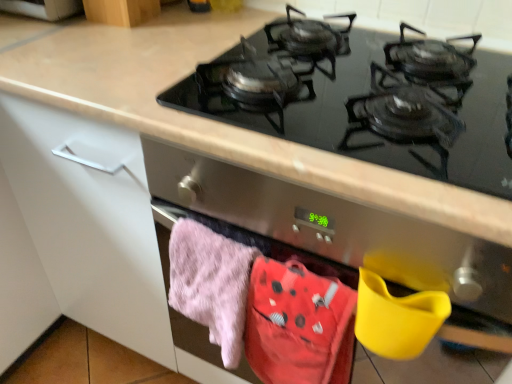
Question: Based on their sizes in the image, would you say fluffy pink towel at lower left is bigger or smaller than black glass gas stove at upper center?

Choices:
 (A) small
 (B) big

Answer: (A)

Question: From the image's perspective, relative to black glass gas stove at upper center, is fluffy pink towel at lower left above or below?

Choices:
 (A) above
 (B) below

Answer: (B)

Question: Which of these objects is positioned farthest from the wooden cabinet at upper left?

Choices:
 (A) black glass gas stove at upper center
 (B) stainless steel oven at center
 (C) fluffy cotton towel at lower center
 (D) fluffy pink towel at lower left

Answer: (C)

Question: Which of these objects is positioned farthest from the fluffy cotton towel at lower center?

Choices:
 (A) black glass gas stove at upper center
 (B) stainless steel oven at center
 (C) fluffy pink towel at lower left
 (D) wooden cabinet at upper left

Answer: (D)